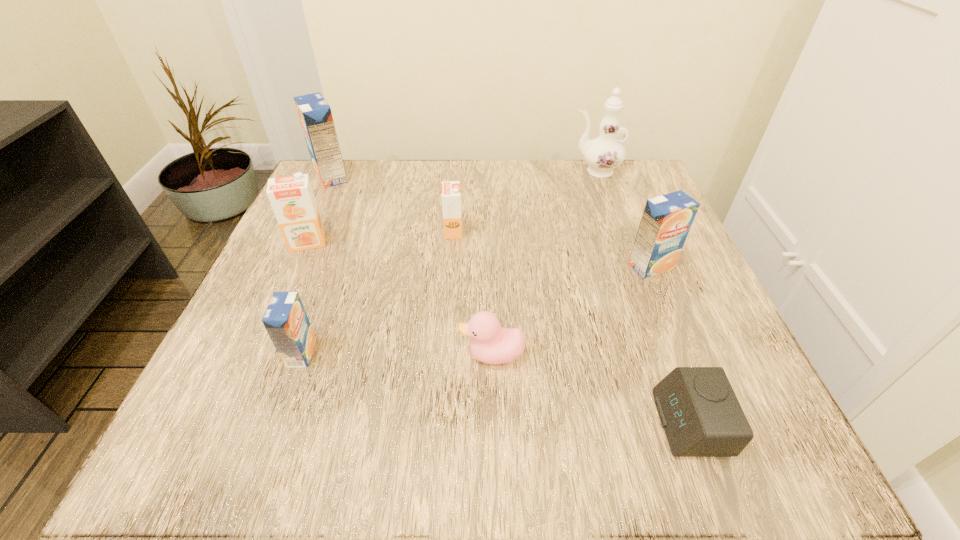
Locate an element on the screen. The image size is (960, 540). vacant area situated on the front of the third object from left to right is located at coordinates (285, 397).

Where is `free space located 0.170m on the left of the right orange orange juice`? The image size is (960, 540). free space located 0.170m on the left of the right orange orange juice is located at coordinates (360, 231).

Where is `vacant space situated on the front-facing side of the duckling`? vacant space situated on the front-facing side of the duckling is located at coordinates (303, 355).

Where is `free space located 0.330m on the front-facing side of the duckling`? This screenshot has width=960, height=540. free space located 0.330m on the front-facing side of the duckling is located at coordinates (245, 355).

Where is `vacant region located on the front-facing side of the duckling`? vacant region located on the front-facing side of the duckling is located at coordinates (257, 355).

Identify the location of vacant space located 0.100m on the front-facing side of the shortest object. (587, 423).

This screenshot has height=540, width=960. I want to click on vacant space located on the front-facing side of the shortest object, so click(513, 423).

The height and width of the screenshot is (540, 960). Find the location of `free region located 0.280m on the front-facing side of the shortest object`. free region located 0.280m on the front-facing side of the shortest object is located at coordinates (453, 423).

Where is `chinaware at the far edge`? This screenshot has width=960, height=540. chinaware at the far edge is located at coordinates (604, 153).

The width and height of the screenshot is (960, 540). Find the location of `orange_juice at the far edge`. orange_juice at the far edge is located at coordinates (315, 115).